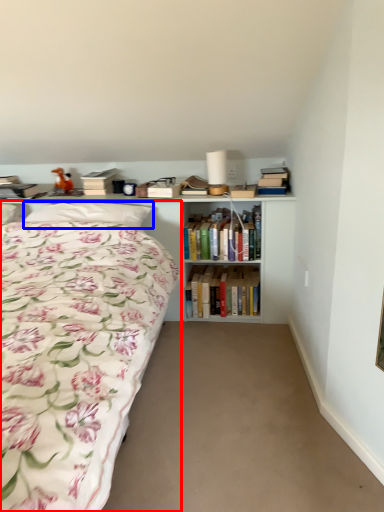
Question: Which point is closer to the camera, bed (highlighted by a red box) or pillow (highlighted by a blue box)?

Choices:
 (A) bed
 (B) pillow

Answer: (A)